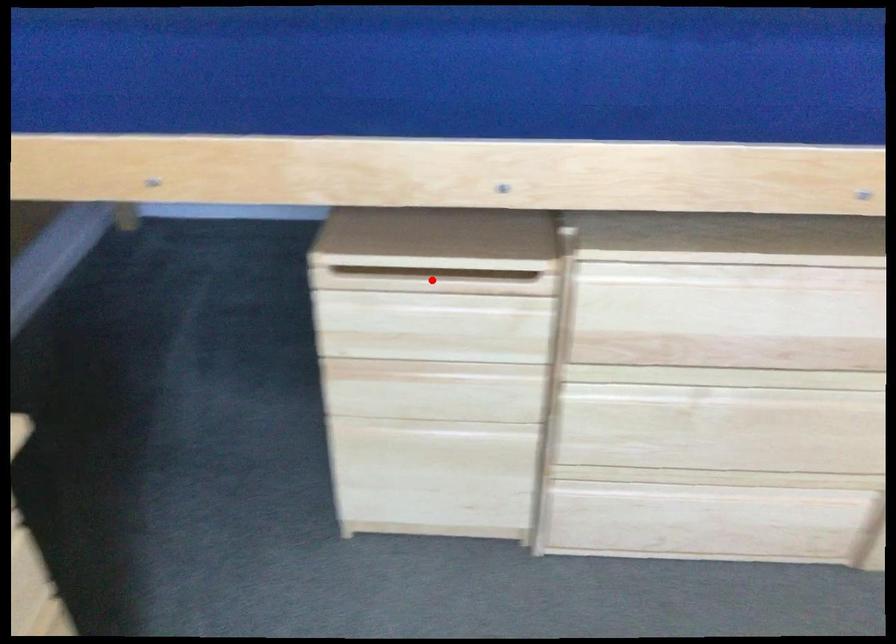
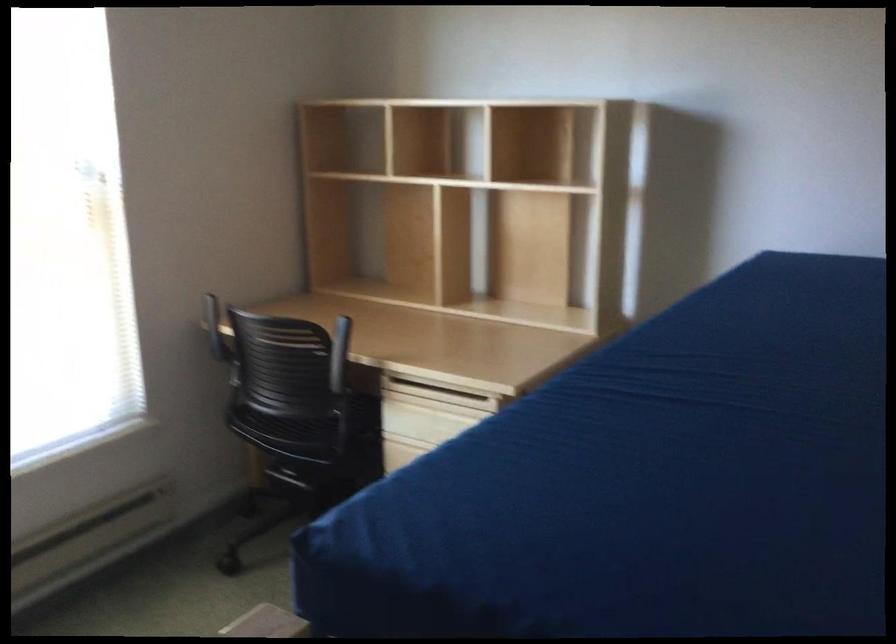
Question: I am providing you with two images of the same scene from different viewpoints. A red point is marked on the first image. At the location where the point appears in image 1, is it still visible in image 2?

Choices:
 (A) Yes
 (B) No

Answer: (B)